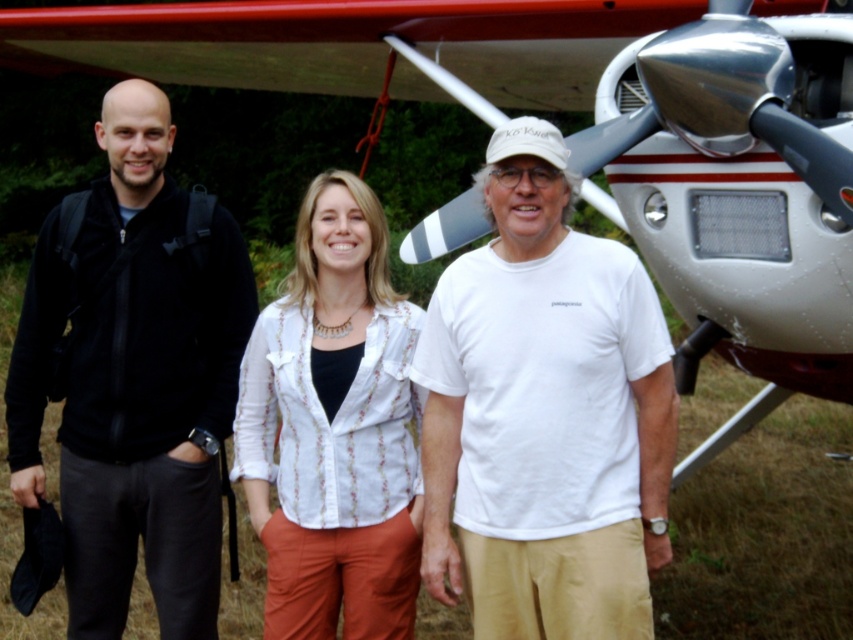
You are a photographer trying to capture a clear photo of the black fabric jacket at left and the white textured blouse at center. Which one is positioned higher in the frame?

The black fabric jacket at left is positioned higher in the frame than the white textured blouse at center.